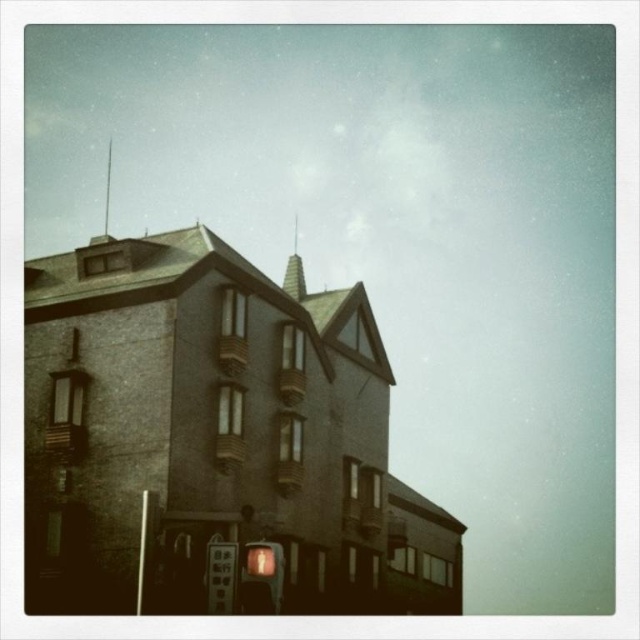
Question: Which object appears farthest from the camera in this image?

Choices:
 (A) metallic gray sign at lower center
 (B) matte orange traffic light at center

Answer: (A)

Question: Is matte orange traffic light at center below metallic gray sign at lower center?

Choices:
 (A) no
 (B) yes

Answer: (A)

Question: Which object is farther from the camera taking this photo?

Choices:
 (A) matte orange traffic light at center
 (B) metallic gray sign at lower center

Answer: (B)

Question: Is matte orange traffic light at center thinner than metallic gray sign at lower center?

Choices:
 (A) yes
 (B) no

Answer: (A)

Question: Is matte orange traffic light at center below metallic gray sign at lower center?

Choices:
 (A) yes
 (B) no

Answer: (B)